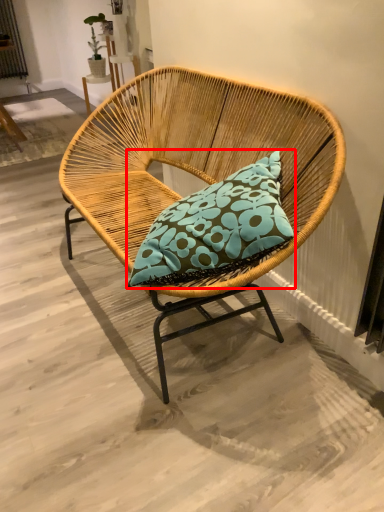
Question: From the image's perspective, where is pillow (annotated by the red box) located in relation to chair in the image?

Choices:
 (A) below
 (B) above

Answer: (A)